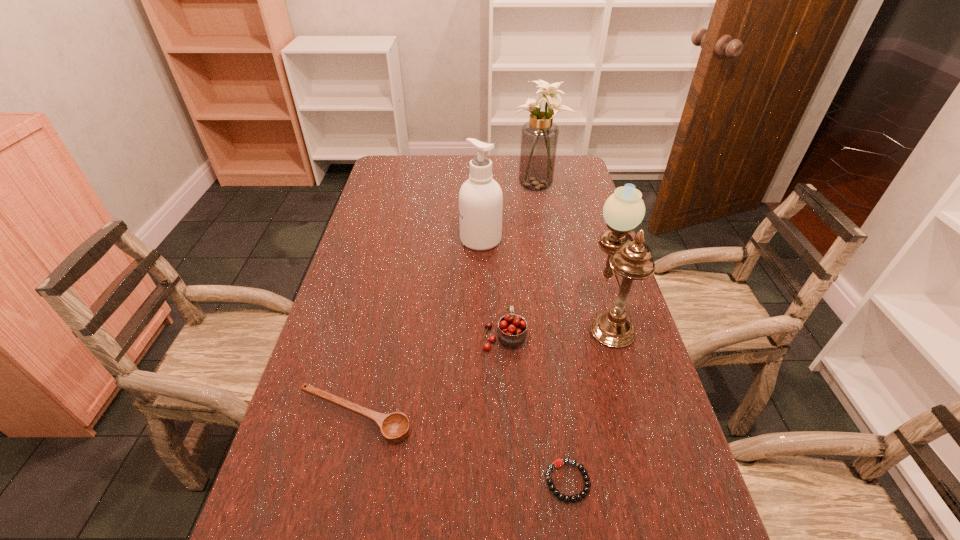
Identify the location of flower arrangement. This screenshot has width=960, height=540. (539, 136).

Where is `oil lamp`? This screenshot has width=960, height=540. oil lamp is located at coordinates (624, 210).

Image resolution: width=960 pixels, height=540 pixels. Find the location of `cleansing agent`. cleansing agent is located at coordinates [480, 197].

Locate an element on the screen. cherry is located at coordinates (511, 332).

Image resolution: width=960 pixels, height=540 pixels. I want to click on the second shortest object, so click(394, 427).

At what (x,y) coordinates should I click in order to perform the action: click on the fifth farthest object. Please return your answer as a coordinate pair (x, y). Looking at the image, I should click on (394, 427).

Image resolution: width=960 pixels, height=540 pixels. Find the location of `the nearest object`. the nearest object is located at coordinates (558, 463).

Locate an element on the screen. bracelet is located at coordinates (558, 463).

I want to click on vacant space situated on the front of the farthest object, so click(543, 216).

Find the location of a particular element. free point located on the back of the oil lamp is located at coordinates (581, 224).